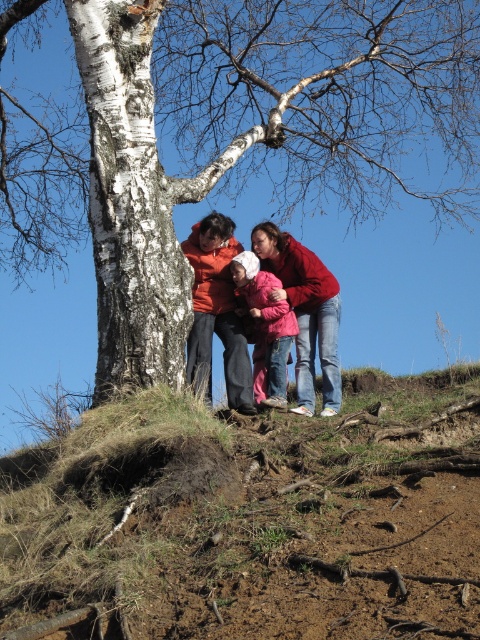
Which is in front, point (228, 70) or point (253, 353)?

Positioned in front is point (253, 353).

Is white bark tree at center positioned in front of pink fleece jacket at center?

No.

Measure the distance between white bark tree at center and camera.

11.47 meters

What are the coordinates of `white bark tree at center` in the screenshot? It's located at (226, 138).

Does point (67, 548) lie in front of point (131, 99)?

Yes, point (67, 548) is in front of point (131, 99).

Can you confirm if dried grass at center is smaller than white bark tree at center?

No, dried grass at center is not smaller than white bark tree at center.

Locate an element on the screen. Image resolution: width=480 pixels, height=640 pixels. dried grass at center is located at coordinates (251, 518).

Does white bark tree at center have a lesser height compared to matte orange sweater at center?

Indeed, white bark tree at center has a lesser height compared to matte orange sweater at center.

Is point (186, 65) more distant than point (276, 272)?

That is True.

Where is `white bark tree at center`? white bark tree at center is located at coordinates (226, 138).